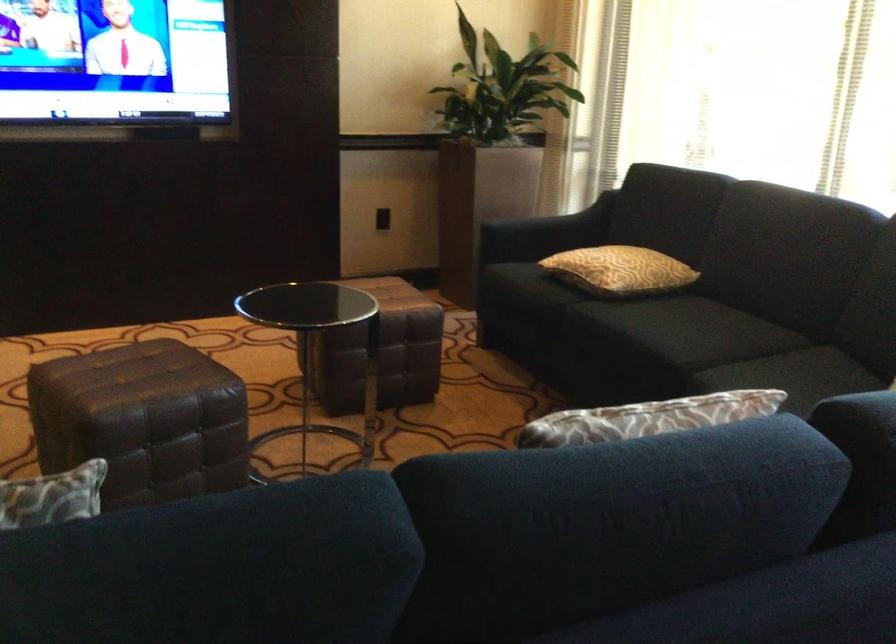
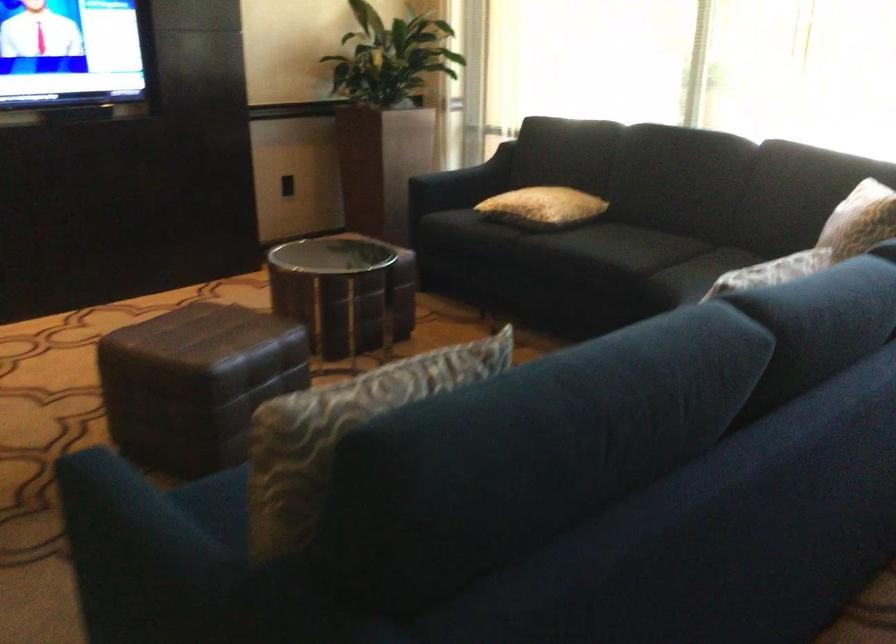
The point at (91, 433) is marked in the first image. Where is the corresponding point in the second image?

(195, 383)